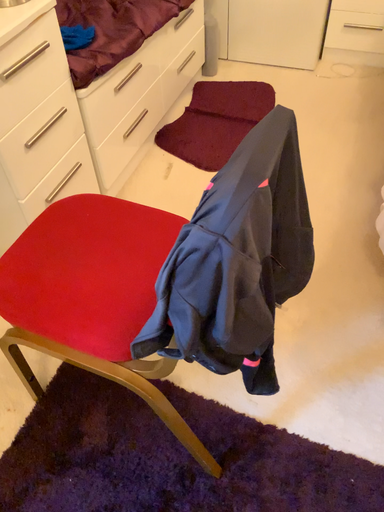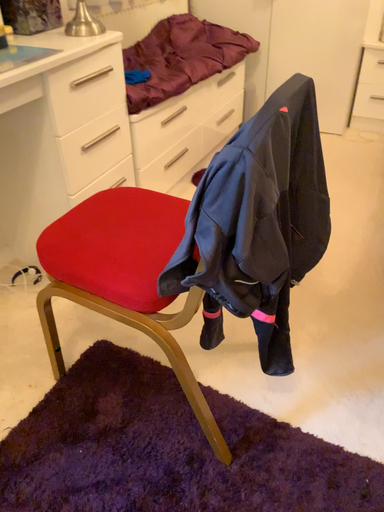
Question: Which way did the camera rotate in the video?

Choices:
 (A) rotated downward
 (B) rotated upward

Answer: (B)